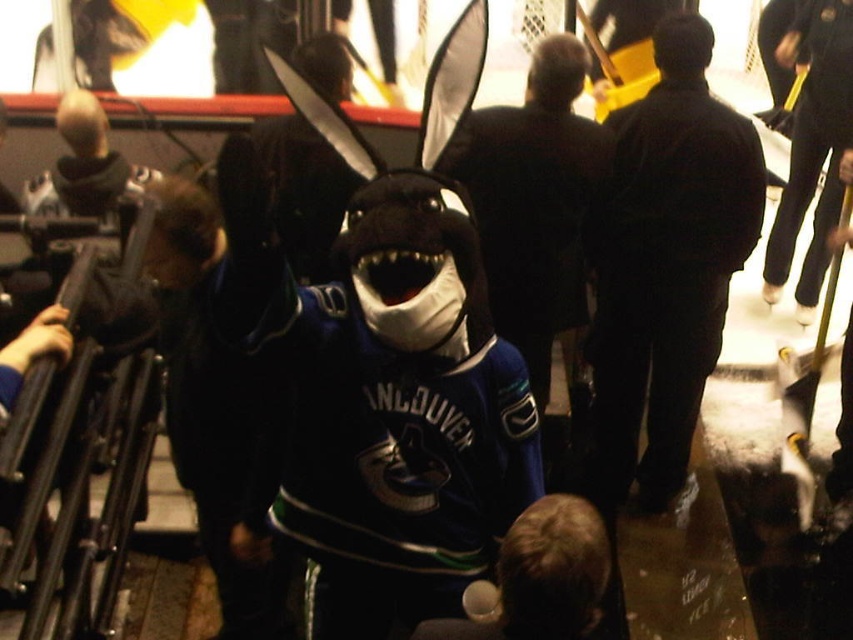
You are a photographer at the hockey game and want to capture the Vancouver Canucks mascot, the velvet plush shark at center, in your shot. The mascot is at point (383, 403). If your camera has a zoom lens that can focus on a specific coordinate, what coordinates should you input to ensure the mascot is centered in your photo?

The velvet plush shark at center is located at point (383, 403), so you should input the coordinates (383, 403) to center the mascot in your photo.

You are organizing a mascot parade and need to arrange the velvet plush shark at center and dark blue jacket at center in a line. Since space is limited, which object should you place first to ensure both fit in the available space?

The velvet plush shark at center should be placed first because it occupies less space than the dark blue jacket at center, ensuring both can fit in the limited space.

You are a photographer at the hockey game and want to capture both the dark blue jacket at center and the black matte jacket at center in a single shot. Which jacket should you position your camera to the left of to ensure both are in frame?

You should position your camera to the left of the dark blue jacket at center, as it is to the right of the black matte jacket at center. This way, both jackets will be included in the frame.